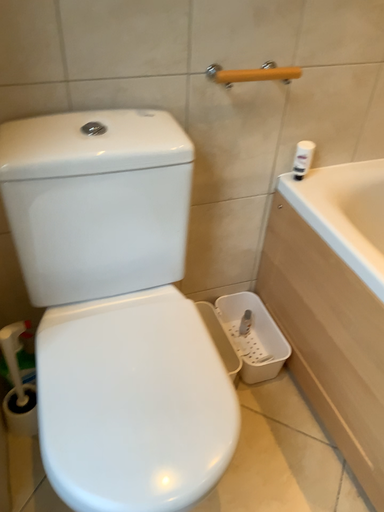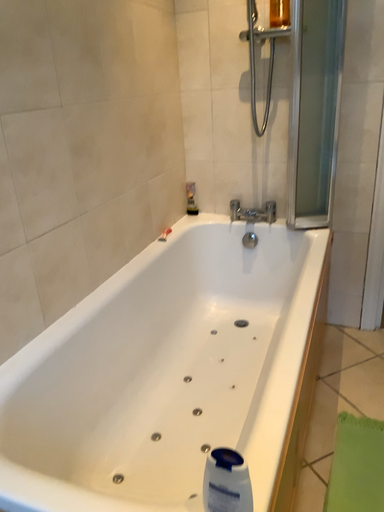
Question: How did the camera likely rotate when shooting the video?

Choices:
 (A) rotated downward
 (B) rotated upward

Answer: (B)